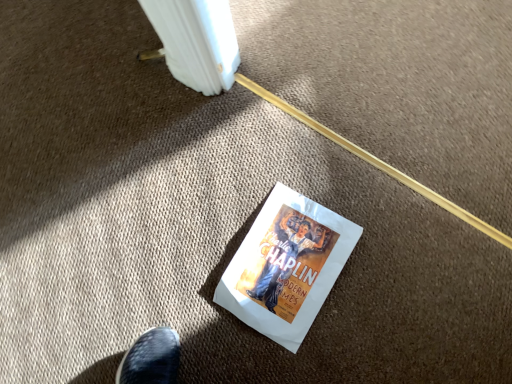
Where is `vacant area to the left of white paper at center`? This screenshot has width=512, height=384. vacant area to the left of white paper at center is located at coordinates (188, 294).